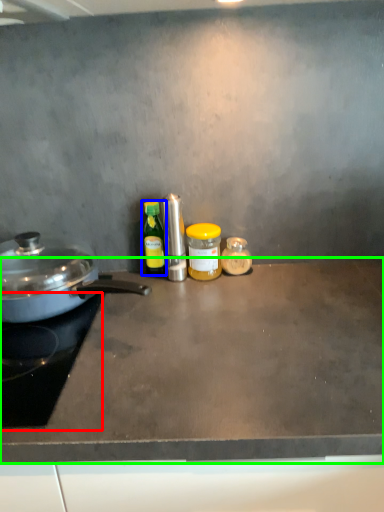
Question: Which is nearer to the gas stove (highlighted by a red box)? kitchen appliance (highlighted by a blue box) or countertop (highlighted by a green box).

Choices:
 (A) kitchen appliance
 (B) countertop

Answer: (B)